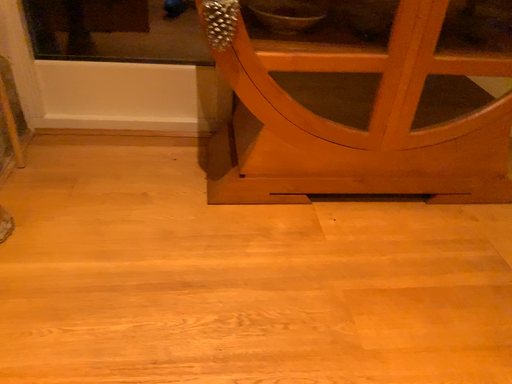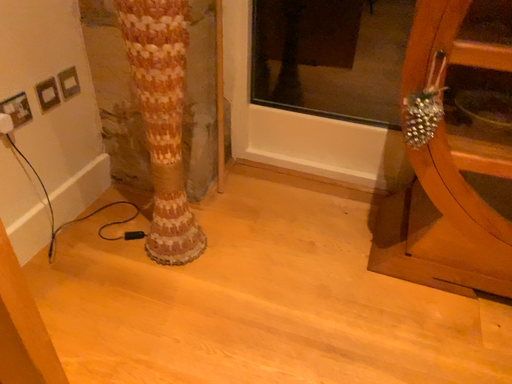
Question: Which way did the camera rotate in the video?

Choices:
 (A) rotated left
 (B) rotated right

Answer: (A)